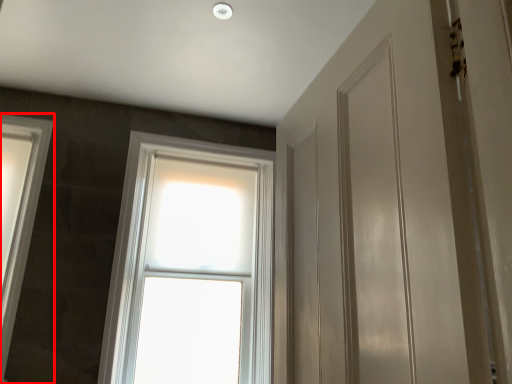
Question: From the image, what is the correct spatial relationship of window (annotated by the red box) in relation to window?

Choices:
 (A) left
 (B) right

Answer: (A)